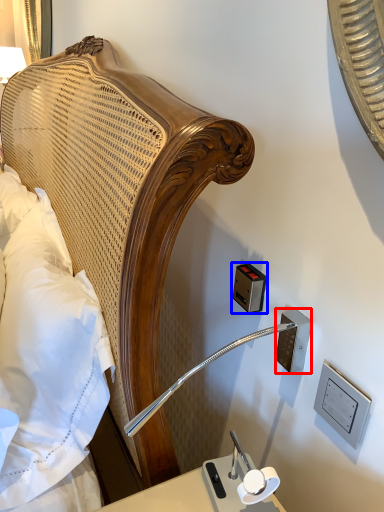
Question: Among these objects, which one is nearest to the camera, electric outlet (highlighted by a red box) or electric outlet (highlighted by a blue box)?

Choices:
 (A) electric outlet
 (B) electric outlet

Answer: (A)